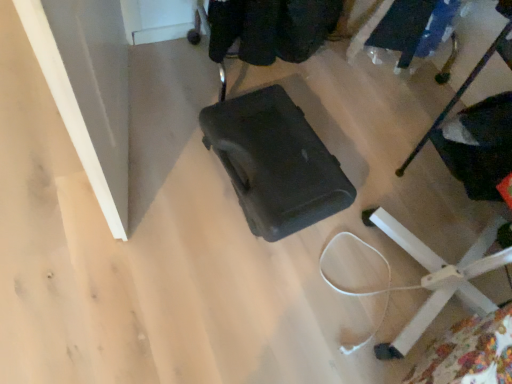
Question: Is white plastic chair at lower right at the right side of matte black suitcase at center?

Choices:
 (A) yes
 (B) no

Answer: (A)

Question: From a real-world perspective, is white plastic chair at lower right on top of matte black suitcase at center?

Choices:
 (A) yes
 (B) no

Answer: (A)

Question: Is white plastic chair at lower right located outside matte black suitcase at center?

Choices:
 (A) yes
 (B) no

Answer: (A)

Question: From a real-world perspective, is white plastic chair at lower right under matte black suitcase at center?

Choices:
 (A) no
 (B) yes

Answer: (A)

Question: Is matte black suitcase at center a part of white plastic chair at lower right?

Choices:
 (A) yes
 (B) no

Answer: (B)

Question: Can you confirm if white plastic chair at lower right is shorter than matte black suitcase at center?

Choices:
 (A) no
 (B) yes

Answer: (A)

Question: Is white plastic chair at lower right surrounded by matte black suitcase at center?

Choices:
 (A) no
 (B) yes

Answer: (A)

Question: Is the position of matte black suitcase at center less distant than that of white plastic chair at lower right?

Choices:
 (A) no
 (B) yes

Answer: (A)

Question: Considering the relative sizes of matte black suitcase at center and white plastic chair at lower right in the image provided, is matte black suitcase at center bigger than white plastic chair at lower right?

Choices:
 (A) no
 (B) yes

Answer: (A)

Question: Is matte black suitcase at center oriented away from white plastic chair at lower right?

Choices:
 (A) no
 (B) yes

Answer: (A)

Question: Is matte black suitcase at center wider than white plastic chair at lower right?

Choices:
 (A) yes
 (B) no

Answer: (B)

Question: Is matte black suitcase at center directly adjacent to white plastic chair at lower right?

Choices:
 (A) no
 (B) yes

Answer: (A)

Question: Is white plastic chair at lower right in front of or behind matte black suitcase at center in the image?

Choices:
 (A) front
 (B) behind

Answer: (A)